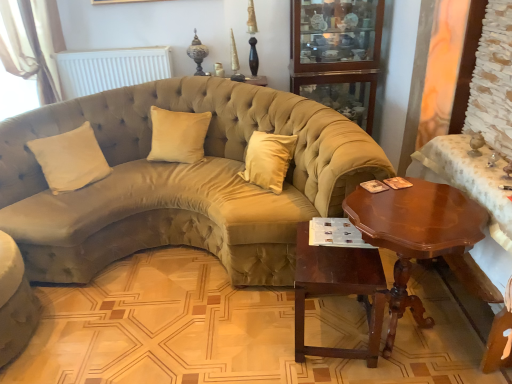
Locate an element on the screen. free space between mahogany wood table at lower center and velvet beige couch at lower left, the second studio couch from the right is located at coordinates (161, 334).